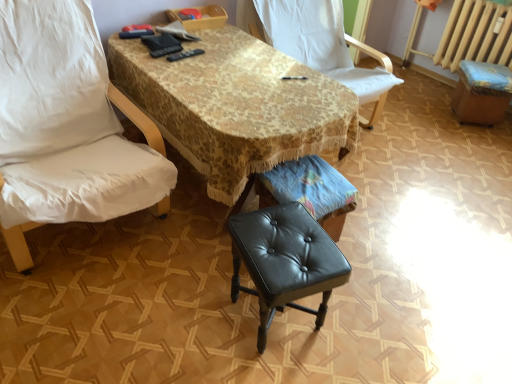
Where is `blank space situated above black leather music stool at center (from a real-world perspective)`? Image resolution: width=512 pixels, height=384 pixels. blank space situated above black leather music stool at center (from a real-world perspective) is located at coordinates click(x=313, y=180).